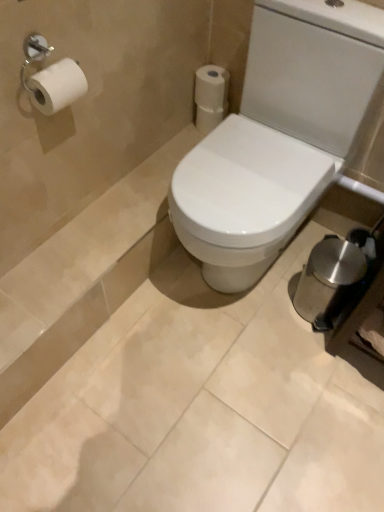
Question: Is white glossy toilet at center positioned in front of white matte toilet paper at upper center, acting as the 2th toilet paper starting from the front?

Choices:
 (A) yes
 (B) no

Answer: (A)

Question: From a real-world perspective, is white glossy toilet at center over white matte toilet paper at upper center, acting as the 2th toilet paper starting from the front?

Choices:
 (A) no
 (B) yes

Answer: (B)

Question: Does white glossy toilet at center have a lesser height compared to white matte toilet paper at upper center, acting as the 2th toilet paper starting from the front?

Choices:
 (A) no
 (B) yes

Answer: (A)

Question: Is white matte toilet paper at upper center, arranged as the first toilet paper when viewed from the back, surrounded by white glossy toilet at center?

Choices:
 (A) yes
 (B) no

Answer: (B)

Question: Does white glossy toilet at center have a greater height compared to white matte toilet paper at upper center, acting as the 2th toilet paper starting from the front?

Choices:
 (A) yes
 (B) no

Answer: (A)

Question: Is point pyautogui.click(x=210, y=74) positioned closer to the camera than point pyautogui.click(x=205, y=134)?

Choices:
 (A) closer
 (B) farther

Answer: (A)

Question: Visually, is white matte toilet paper at upper right, positioned as the 2th toilet paper in back-to-front order, positioned to the left or to the right of white matte toilet paper at upper center, arranged as the first toilet paper when viewed from the back?

Choices:
 (A) right
 (B) left

Answer: (B)

Question: From a real-world perspective, is white matte toilet paper at upper right, positioned as the 2th toilet paper in back-to-front order, above or below white matte toilet paper at upper center, acting as the 2th toilet paper starting from the front?

Choices:
 (A) below
 (B) above

Answer: (B)

Question: Considering the positions of white matte toilet paper at upper right, placed as the 1th toilet paper when sorted from front to back, and white matte toilet paper at upper center, arranged as the first toilet paper when viewed from the back, in the image, is white matte toilet paper at upper right, placed as the 1th toilet paper when sorted from front to back, bigger or smaller than white matte toilet paper at upper center, arranged as the first toilet paper when viewed from the back,?

Choices:
 (A) big
 (B) small

Answer: (A)

Question: Is white matte toilet paper at upper center, acting as the 2th toilet paper starting from the front, to the left or to the right of white matte toilet paper at upper right, placed as the 1th toilet paper when sorted from front to back, in the image?

Choices:
 (A) left
 (B) right

Answer: (B)

Question: From a real-world perspective, is white matte toilet paper at upper center, acting as the 2th toilet paper starting from the front, positioned above or below white matte toilet paper at upper right, positioned as the 2th toilet paper in back-to-front order?

Choices:
 (A) above
 (B) below

Answer: (B)

Question: In terms of height, does white matte toilet paper at upper center, acting as the 2th toilet paper starting from the front, look taller or shorter compared to white matte toilet paper at upper right, placed as the 1th toilet paper when sorted from front to back?

Choices:
 (A) short
 (B) tall

Answer: (B)

Question: Considering the positions of point (210, 120) and point (213, 96), is point (210, 120) closer or farther from the camera than point (213, 96)?

Choices:
 (A) closer
 (B) farther

Answer: (B)

Question: Would you say white matte toilet paper at upper center, arranged as the first toilet paper when viewed from the back, is inside or outside white glossy toilet at center?

Choices:
 (A) outside
 (B) inside

Answer: (A)

Question: From the image's perspective, is white matte toilet paper at upper center, arranged as the first toilet paper when viewed from the back, above or below white glossy toilet at center?

Choices:
 (A) above
 (B) below

Answer: (A)